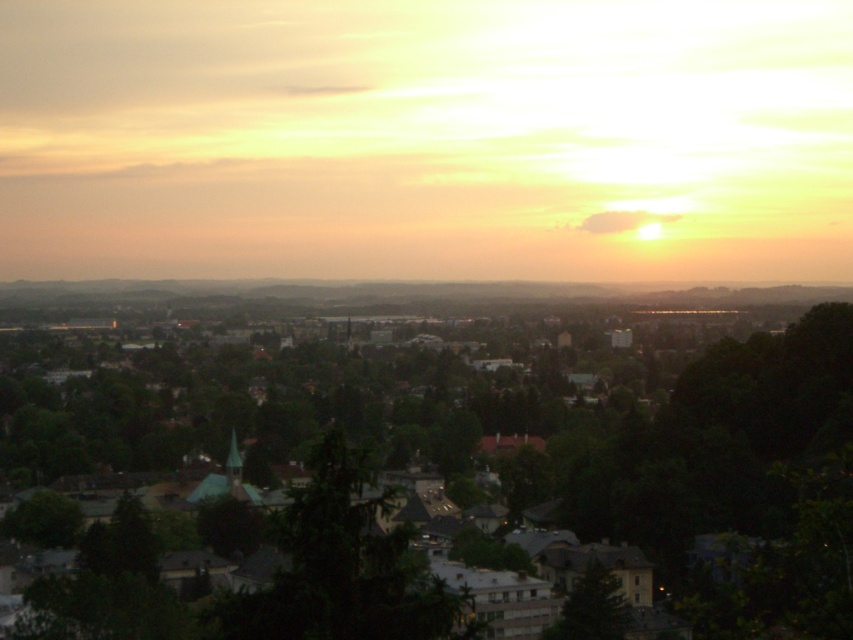
Is dark gray concrete buildings at center taller than green matte tree at lower center?

Yes, dark gray concrete buildings at center is taller than green matte tree at lower center.

Is dark gray concrete buildings at center thinner than green matte tree at lower center?

No.

Is point (538, 403) positioned behind point (579, 605)?

Yes, it is.

Find the location of a particular element. This screenshot has height=640, width=853. dark gray concrete buildings at center is located at coordinates pyautogui.click(x=457, y=481).